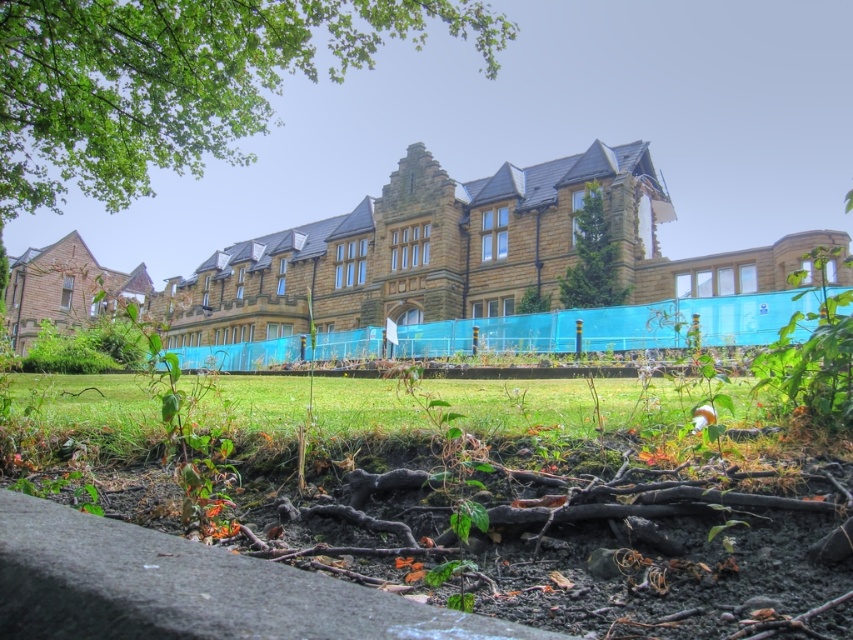
From the picture: You are standing in front of the historic building and want to take a photo of the green leafy tree at upper left. Where should you position yourself to capture it in the frame?

To capture the green leafy tree at upper left in your photo, position yourself so that the tree is located at the coordinates approximately 0.127 along the horizontal axis and 0.208 along the vertical axis within the frame.

You are a landscape architect planning to plant a new tree in the disturbed earth area. Considering the green leafy tree at upper left and the green textured tree at center, which tree is located higher up in the image?

The green leafy tree at upper left is positioned over the green textured tree at center, so it is higher up in the image.

You are a landscape architect evaluating the historic building. You notice two trees in the scene, the green leafy tree at upper left and the green textured tree at center. Which tree would cast a longer shadow during midday when the sun is directly overhead?

The green leafy tree at upper left is much taller than the green textured tree at center, so it would cast a longer shadow during midday when the sun is directly overhead.